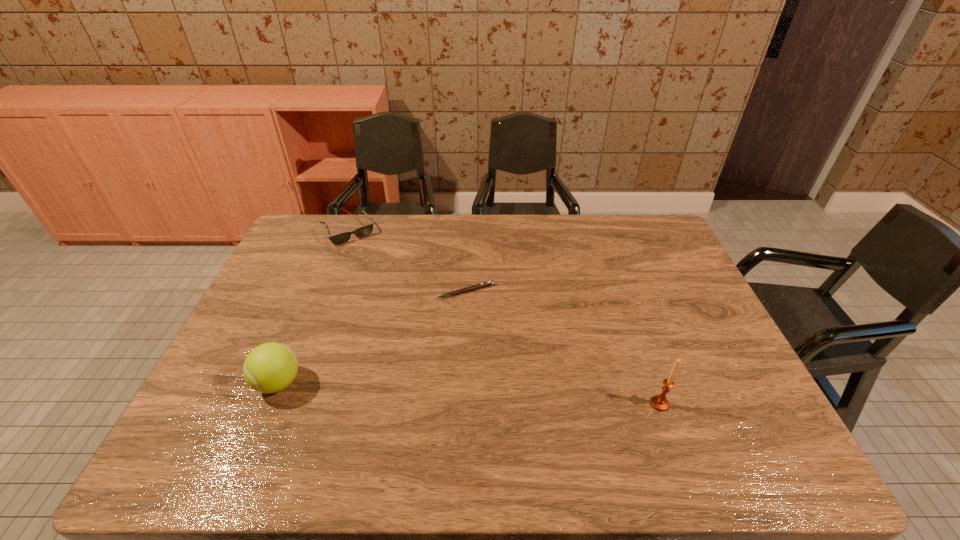
At what (x,y) coordinates should I click in order to perform the action: click on unoccupied area between the farthest object and the tallest object. Please return your answer as a coordinate pair (x, y). The image size is (960, 540). Looking at the image, I should click on (504, 317).

This screenshot has height=540, width=960. What are the coordinates of `empty location between the farthest object and the second farthest object` in the screenshot? It's located at (408, 261).

The image size is (960, 540). What are the coordinates of `free space between the tennis ball and the rightmost object` in the screenshot? It's located at pos(469,393).

Where is `free space between the second tallest object and the tallest object`? The height and width of the screenshot is (540, 960). free space between the second tallest object and the tallest object is located at coordinates (469, 393).

At what (x,y) coordinates should I click in order to perform the action: click on free space between the pen and the rightmost object. Please return your answer as a coordinate pair (x, y). This screenshot has width=960, height=540. Looking at the image, I should click on (563, 347).

I want to click on vacant area that lies between the farthest object and the second tallest object, so click(314, 307).

Locate which object is the third closest to the tennis ball. Please provide its 2D coordinates. Your answer should be formatted as a tuple, i.e. [(x, y)], where the tuple contains the x and y coordinates of a point satisfying the conditions above.

[(659, 402)]

This screenshot has height=540, width=960. I want to click on the third closest object to the rightmost object, so click(363, 231).

In order to click on free space that satisfies the following two spatial constraints: 1. on the back side of the second shortest object; 2. on the right side of the tennis ball in this screenshot , I will do `click(341, 231)`.